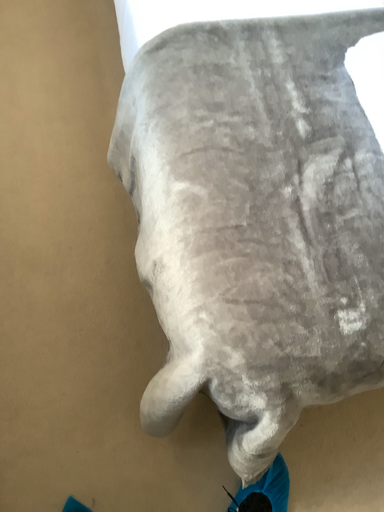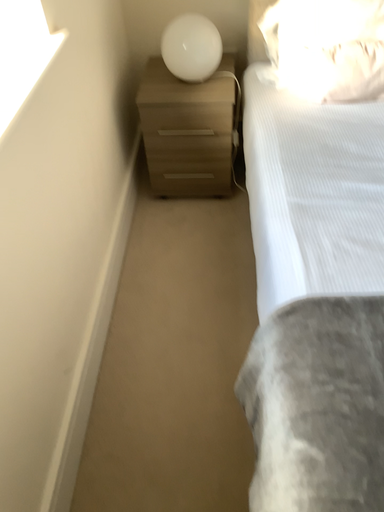
Question: Which way did the camera rotate in the video?

Choices:
 (A) rotated upward
 (B) rotated downward

Answer: (A)